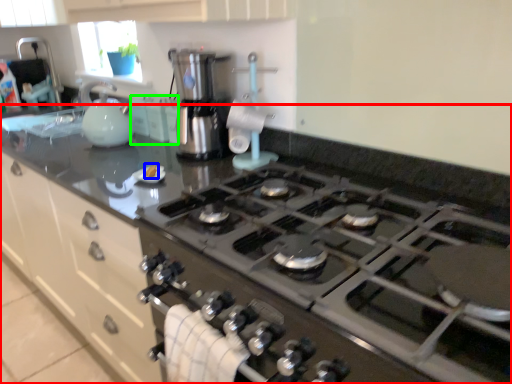
Question: Estimate the real-world distances between objects in this image. Which object is closer to countertop (highlighted by a red box), food (highlighted by a blue box) or cabinetry (highlighted by a green box)?

Choices:
 (A) food
 (B) cabinetry

Answer: (A)